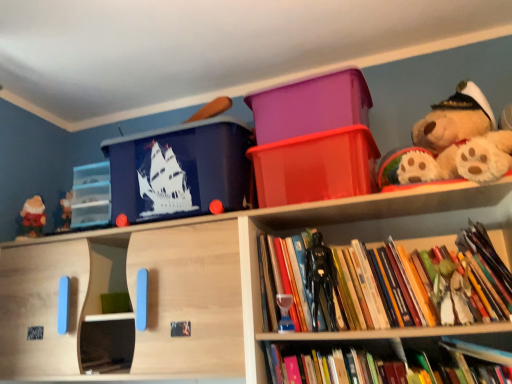
Question: Which direction should I rotate to face hardcover book at lower center, which is the second book in top-to-bottom order, — up or down?

Choices:
 (A) up
 (B) down

Answer: (B)

Question: From the image's perspective, is shiny red plastic container at upper center, which is the first storage box from right to left, under translucent glass hourglass at center, positioned as the second toy in left-to-right order?

Choices:
 (A) no
 (B) yes

Answer: (A)

Question: Is shiny red plastic container at upper center, which is the first storage box from right to left, positioned in front of translucent glass hourglass at center, which is the second toy from back to front?

Choices:
 (A) yes
 (B) no

Answer: (A)

Question: Considering the relative sizes of shiny red plastic container at upper center, which is the first storage box from right to left, and translucent glass hourglass at center, positioned as the second toy in left-to-right order, in the image provided, is shiny red plastic container at upper center, which is the first storage box from right to left, wider than translucent glass hourglass at center, positioned as the second toy in left-to-right order,?

Choices:
 (A) no
 (B) yes

Answer: (B)

Question: Is translucent glass hourglass at center, placed as the 3th toy when sorted from front to back, completely or partially inside shiny red plastic container at upper center, which is the first storage box from right to left?

Choices:
 (A) no
 (B) yes

Answer: (A)

Question: Is shiny red plastic container at upper center, which is the first storage box from right to left, to the left of translucent glass hourglass at center, placed as the 3th toy when sorted from front to back, from the viewer's perspective?

Choices:
 (A) no
 (B) yes

Answer: (A)

Question: Is shiny red plastic container at upper center, which is the first storage box from right to left, outside of translucent glass hourglass at center, positioned as the second toy in left-to-right order?

Choices:
 (A) no
 (B) yes

Answer: (B)

Question: Does wooden doll at lower right, acting as the first toy starting from the front, come in front of transparent plastic drawers at left, which is the fourth storage box in right-to-left order?

Choices:
 (A) no
 (B) yes

Answer: (B)

Question: From the image's perspective, is wooden doll at lower right, acting as the first toy starting from the front, on transparent plastic drawers at left, which is the fourth storage box in right-to-left order?

Choices:
 (A) no
 (B) yes

Answer: (A)

Question: From a real-world perspective, is wooden doll at lower right, placed as the fourth toy when sorted from left to right, on transparent plastic drawers at left, which ranks as the 1th storage box in left-to-right order?

Choices:
 (A) no
 (B) yes

Answer: (A)

Question: Would you say wooden doll at lower right, positioned as the 4th toy in back-to-front order, contains transparent plastic drawers at left, which is the fourth storage box in right-to-left order?

Choices:
 (A) yes
 (B) no

Answer: (B)

Question: Is wooden doll at lower right, acting as the first toy starting from the front, not close to transparent plastic drawers at left, which ranks as the 1th storage box in left-to-right order?

Choices:
 (A) yes
 (B) no

Answer: (A)

Question: Is wooden doll at lower right, positioned as the 4th toy in back-to-front order, to the right of transparent plastic drawers at left, which is the fourth storage box in right-to-left order, from the viewer's perspective?

Choices:
 (A) yes
 (B) no

Answer: (A)

Question: From a real-world perspective, is translucent glass hourglass at center, which is the second toy from back to front, beneath transparent plastic drawers at left, which is the fourth storage box in right-to-left order?

Choices:
 (A) yes
 (B) no

Answer: (A)